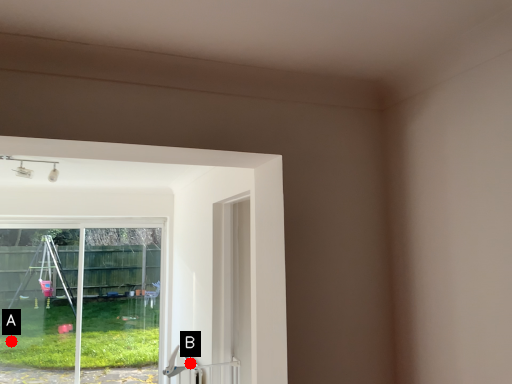
Question: Two points are circled on the image, labeled by A and B beside each circle. Which point is closer to the camera?

Choices:
 (A) A is closer
 (B) B is closer

Answer: (B)